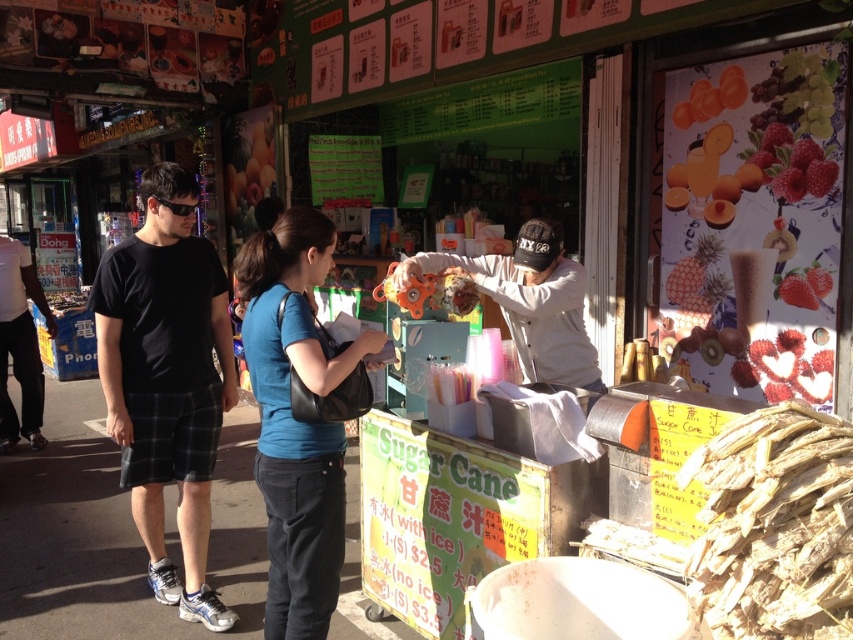
You are a customer at the food stall and want to know which item is shorter between the brown rough sugar cane at lower right and the white matte street vendor at center. Which one should you point to?

The brown rough sugar cane at lower right is not as tall as the white matte street vendor at center, so you should point to the brown rough sugar cane at lower right as it is shorter.

Consider the image. You are a customer at the food stall and want to order a drink. You see the black plaid shorts at left and the white matte street vendor at center. Which one should you approach to place your order?

The white matte street vendor at center is the one you should approach to place your order, as they are positioned at the center of the stall, likely the service area, while the black plaid shorts at left belongs to a customer or bystander.